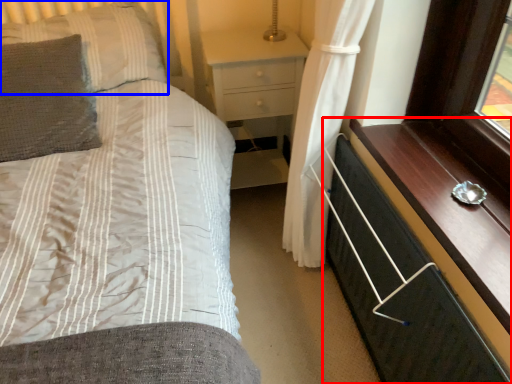
Question: Which object appears farthest to the camera in this image, chest of drawers (highlighted by a red box) or pillow (highlighted by a blue box)?

Choices:
 (A) chest of drawers
 (B) pillow

Answer: (B)